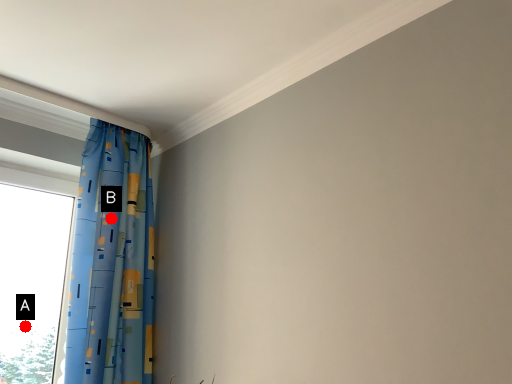
Question: Two points are circled on the image, labeled by A and B beside each circle. Which of the following is the farthest from the observer?

Choices:
 (A) A is further
 (B) B is further

Answer: (A)